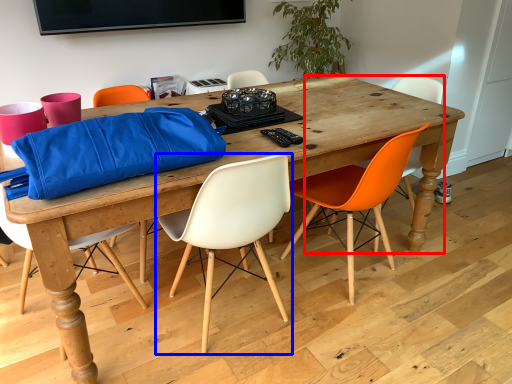
Question: Which object appears closest to the camera in this image, chair (highlighted by a red box) or chair (highlighted by a blue box)?

Choices:
 (A) chair
 (B) chair

Answer: (B)